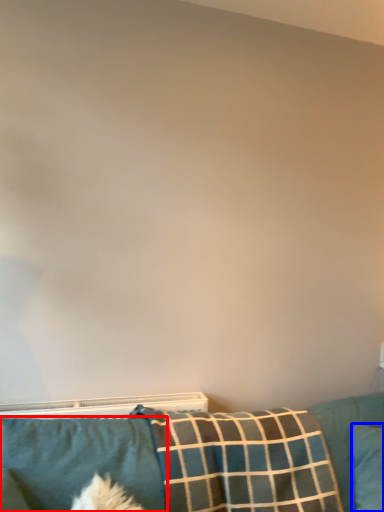
Question: Which object is closer to the camera taking this photo, pillow (highlighted by a red box) or pillow (highlighted by a blue box)?

Choices:
 (A) pillow
 (B) pillow

Answer: (A)